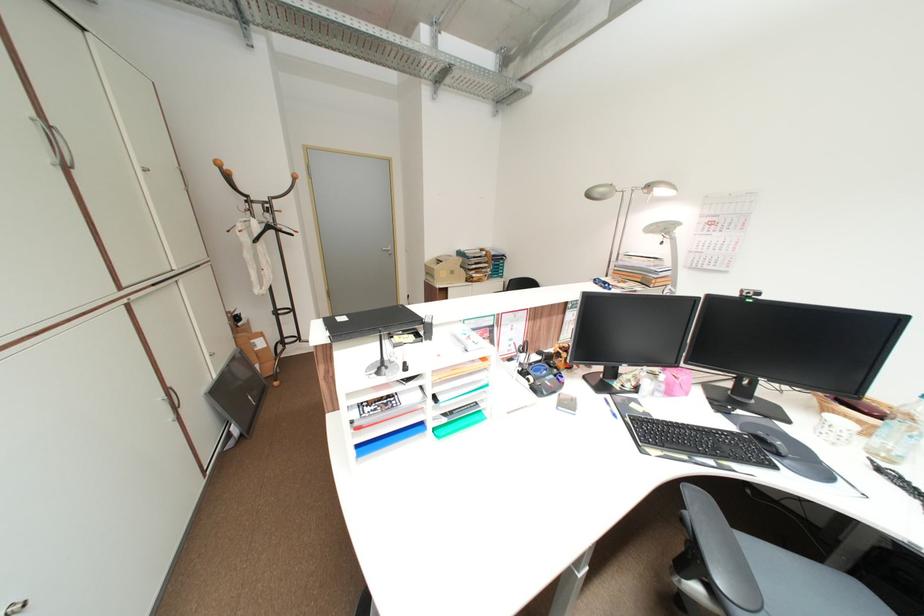
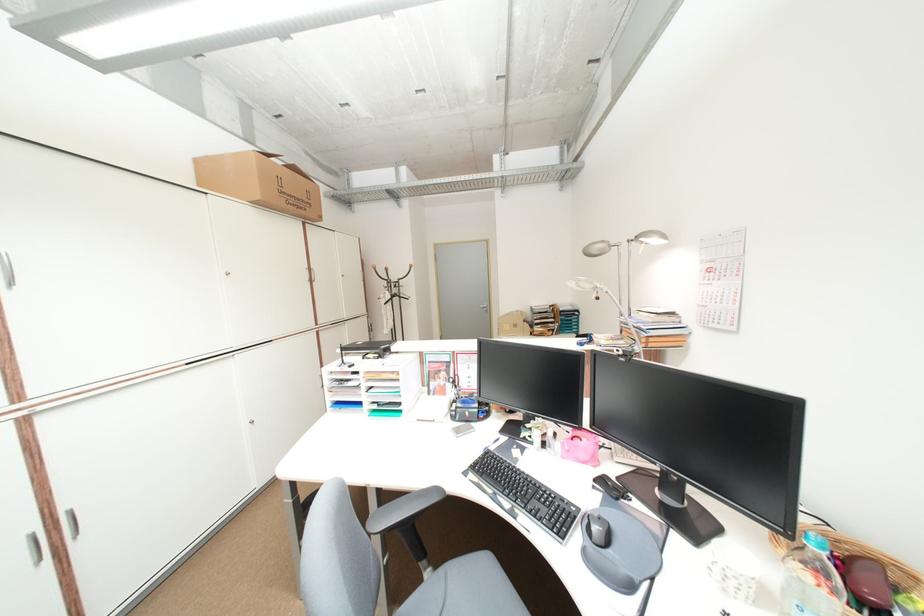
Where in the second image is the point corresponding to point (265, 228) from the first image?

(397, 296)